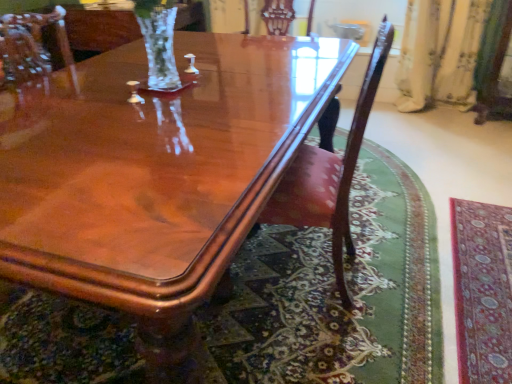
Where is `carpet with intricate patterns at lower right`? The width and height of the screenshot is (512, 384). carpet with intricate patterns at lower right is located at coordinates pos(482,290).

Where is `carpet with intricate patterns at lower right`? carpet with intricate patterns at lower right is located at coordinates (482, 290).

Which is further, [287,176] or [503,336]?

Positioned behind is point [503,336].

Between mahogany wood chair at center and carpet with intricate patterns at lower right, which one has more height?

With more height is mahogany wood chair at center.

Which object is wider, mahogany wood chair at center or carpet with intricate patterns at lower right?

Result: Wider between the two is mahogany wood chair at center.

This screenshot has height=384, width=512. What are the coordinates of `chair above the carpet with intricate patterns at lower right (from a real-world perspective)` in the screenshot? It's located at (330, 171).

Between carpet with intricate patterns at lower right and glossy wood coffee table at center, which one has smaller size?

Smaller between the two is carpet with intricate patterns at lower right.

Is carpet with intricate patterns at lower right to the left of glossy wood coffee table at center from the viewer's perspective?

No, carpet with intricate patterns at lower right is not to the left of glossy wood coffee table at center.

Is carpet with intricate patterns at lower right facing towards glossy wood coffee table at center?

No, carpet with intricate patterns at lower right is not facing towards glossy wood coffee table at center.

From the image's perspective, which one is positioned lower, carpet with intricate patterns at lower right or glossy wood coffee table at center?

carpet with intricate patterns at lower right, from the image's perspective.

Looking at this image, from a real-world perspective, is mahogany wood chair at center positioned above or below glossy wood coffee table at center?

From a real-world perspective, mahogany wood chair at center is physically above glossy wood coffee table at center.

Between mahogany wood chair at center and glossy wood coffee table at center, which one appears on the right side from the viewer's perspective?

mahogany wood chair at center is more to the right.

Identify the location of chair behind the glossy wood coffee table at center. This screenshot has height=384, width=512. (330, 171).

Is mahogany wood chair at center looking in the opposite direction of glossy wood coffee table at center?

Yes, mahogany wood chair at center is positioned with its back facing glossy wood coffee table at center.

Is mahogany wood chair at center located within carpet with intricate patterns at lower right?

No, mahogany wood chair at center is not surrounded by carpet with intricate patterns at lower right.

Considering the positions of objects carpet with intricate patterns at lower right and mahogany wood chair at center in the image provided, who is more to the right, carpet with intricate patterns at lower right or mahogany wood chair at center?

Positioned to the right is carpet with intricate patterns at lower right.

Can you confirm if carpet with intricate patterns at lower right is wider than mahogany wood chair at center?

No, carpet with intricate patterns at lower right is not wider than mahogany wood chair at center.

Between carpet with intricate patterns at lower right and mahogany wood chair at center, which one has smaller size?

With smaller size is carpet with intricate patterns at lower right.

Is glossy wood coffee table at center far away from mahogany wood chair at center?

No, glossy wood coffee table at center is not far away from mahogany wood chair at center.

Is mahogany wood chair at center completely or partially inside glossy wood coffee table at center?

Yes, glossy wood coffee table at center is surrounding mahogany wood chair at center.

Who is smaller, glossy wood coffee table at center or mahogany wood chair at center?

Smaller between the two is mahogany wood chair at center.

Can you confirm if glossy wood coffee table at center is positioned to the right of mahogany wood chair at center?

In fact, glossy wood coffee table at center is to the left of mahogany wood chair at center.

Would you say glossy wood coffee table at center is outside carpet with intricate patterns at lower right?

Yes, glossy wood coffee table at center is outside of carpet with intricate patterns at lower right.

From a real-world perspective, is glossy wood coffee table at center physically located above or below carpet with intricate patterns at lower right?

Clearly, from a real-world perspective, glossy wood coffee table at center is above carpet with intricate patterns at lower right.

Could you measure the distance between glossy wood coffee table at center and carpet with intricate patterns at lower right?

glossy wood coffee table at center is 3.84 feet away from carpet with intricate patterns at lower right.

I want to click on coffee table positioned vertically above the carpet with intricate patterns at lower right (from a real-world perspective), so click(155, 175).

Where is `chair located on the left of carpet with intricate patterns at lower right`? Image resolution: width=512 pixels, height=384 pixels. chair located on the left of carpet with intricate patterns at lower right is located at coordinates pos(330,171).

Where is `mat below the glossy wood coffee table at center (from a real-world perspective)`? mat below the glossy wood coffee table at center (from a real-world perspective) is located at coordinates (482, 290).

Estimate the real-world distances between objects in this image. Which object is closer to carpet with intricate patterns at lower right, mahogany wood chair at center or glossy wood coffee table at center?

The object closer to carpet with intricate patterns at lower right is mahogany wood chair at center.

Estimate the real-world distances between objects in this image. Which object is closer to glossy wood coffee table at center, mahogany wood chair at center or carpet with intricate patterns at lower right?

Among the two, mahogany wood chair at center is located nearer to glossy wood coffee table at center.

Which object lies further to the anchor point mahogany wood chair at center, glossy wood coffee table at center or carpet with intricate patterns at lower right?

carpet with intricate patterns at lower right lies further to mahogany wood chair at center than the other object.

Considering their positions, is glossy wood coffee table at center positioned further to carpet with intricate patterns at lower right than mahogany wood chair at center?

glossy wood coffee table at center lies further to carpet with intricate patterns at lower right than the other object.

Looking at the image, which one is located further to glossy wood coffee table at center, carpet with intricate patterns at lower right or mahogany wood chair at center?

carpet with intricate patterns at lower right.

From the image, which object appears to be farther from mahogany wood chair at center, carpet with intricate patterns at lower right or glossy wood coffee table at center?

The object further to mahogany wood chair at center is carpet with intricate patterns at lower right.

Identify the location of chair between glossy wood coffee table at center and carpet with intricate patterns at lower right. This screenshot has width=512, height=384. coord(330,171).